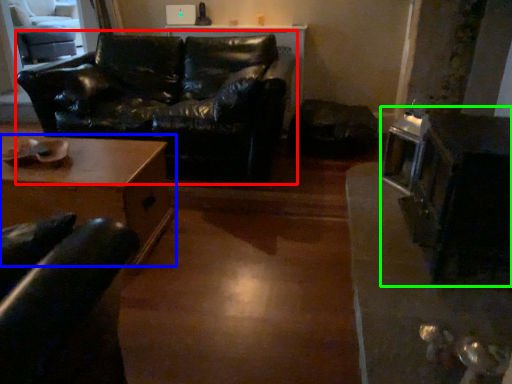
Question: Which object is the closest to the studio couch (highlighted by a red box)? Choose among these: table (highlighted by a blue box) or appliance (highlighted by a green box).

Choices:
 (A) table
 (B) appliance

Answer: (A)